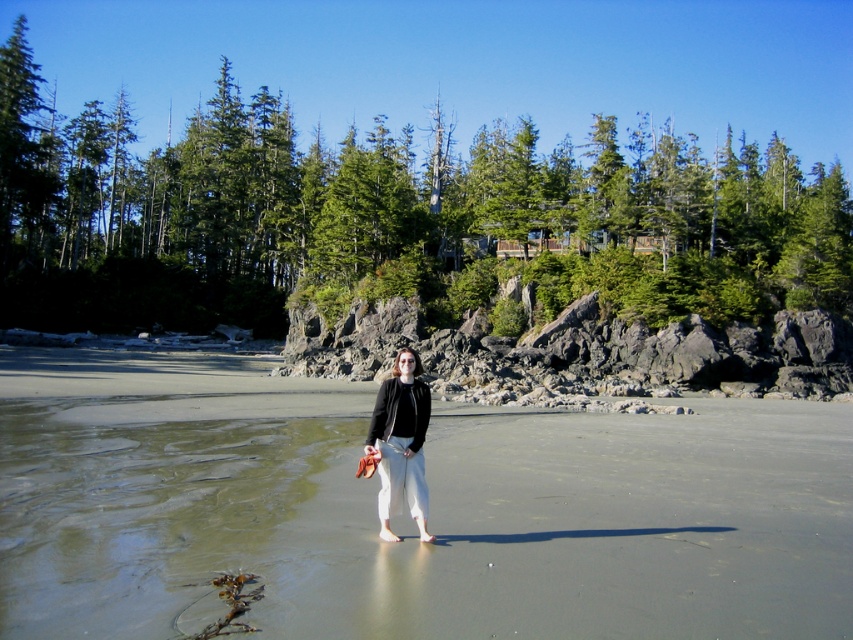
Question: Is smooth sand beach at center smaller than green matte pine at upper center?

Choices:
 (A) no
 (B) yes

Answer: (B)

Question: Is green matte pine at upper center bigger than matte black jacket at center?

Choices:
 (A) no
 (B) yes

Answer: (B)

Question: Which object is closer to the camera taking this photo?

Choices:
 (A) matte black jacket at center
 (B) green matte pine at upper center
 (C) smooth sand beach at center

Answer: (C)

Question: Does smooth sand beach at center have a lesser width compared to matte black jacket at center?

Choices:
 (A) no
 (B) yes

Answer: (A)

Question: Which point is closer to the camera?

Choices:
 (A) (399, 433)
 (B) (296, 180)

Answer: (A)

Question: Which object is the farthest from the matte black jacket at center?

Choices:
 (A) smooth sand beach at center
 (B) green matte pine at upper center

Answer: (B)